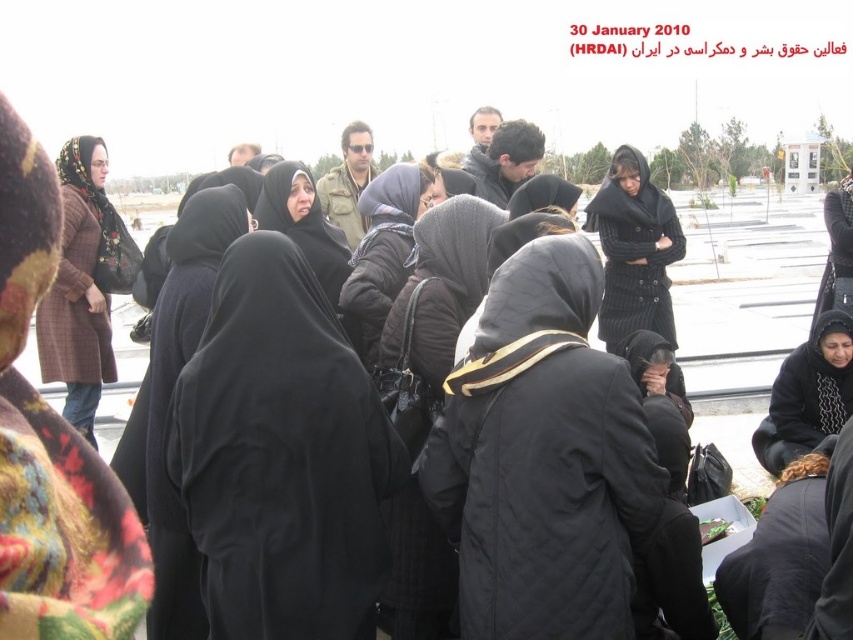
Question: Which object is the farthest from the brown knitted coat at left?

Choices:
 (A) black knitted sweater at center
 (B) black matte hijab at center
 (C) black quilted jacket at center

Answer: (A)

Question: Which of these objects is positioned farthest from the brown knitted coat at left?

Choices:
 (A) black matte hijab at center
 (B) black quilted jacket at lower right
 (C) black quilted jacket at center

Answer: (B)

Question: Which object appears farthest from the camera in this image?

Choices:
 (A) black quilted jacket at lower right
 (B) black fabric headscarf at center
 (C) black matte headscarf at center

Answer: (B)

Question: Can you confirm if black knitted sweater at center is positioned to the left of black quilted jacket at center?

Choices:
 (A) no
 (B) yes

Answer: (A)

Question: Can you confirm if black quilted jacket at lower right is wider than black fabric headscarf at center?

Choices:
 (A) yes
 (B) no

Answer: (B)

Question: Observing the image, what is the correct spatial positioning of black quilted jacket at center in reference to black fabric headscarf at center?

Choices:
 (A) above
 (B) below

Answer: (B)